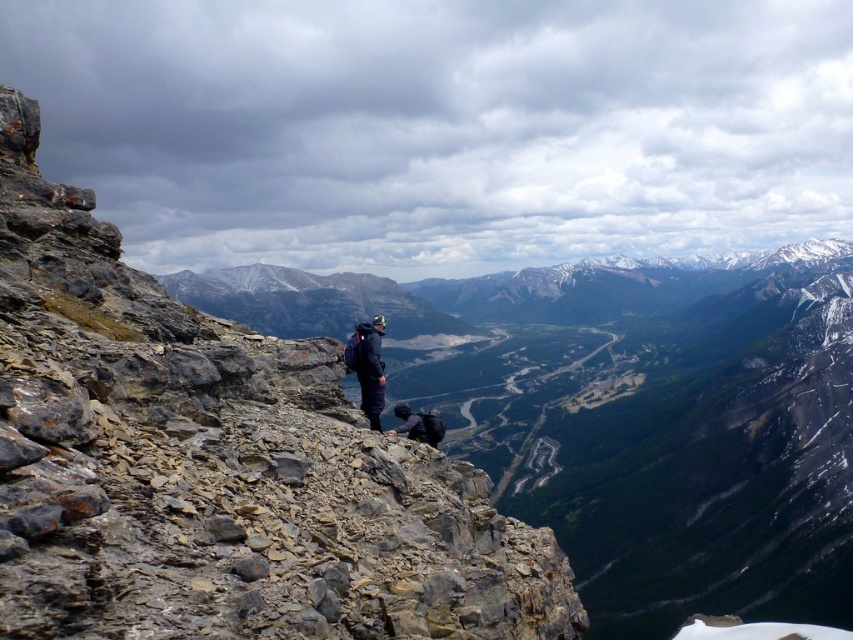
Between dark blue fabric jacket at center and dark blue fabric backpack at center, which one has more height?

dark blue fabric backpack at center

Is the position of dark blue fabric jacket at center less distant than that of dark blue fabric backpack at center?

Yes, dark blue fabric jacket at center is closer to the viewer.

Locate an element on the screen. Image resolution: width=853 pixels, height=640 pixels. dark blue fabric jacket at center is located at coordinates (368, 365).